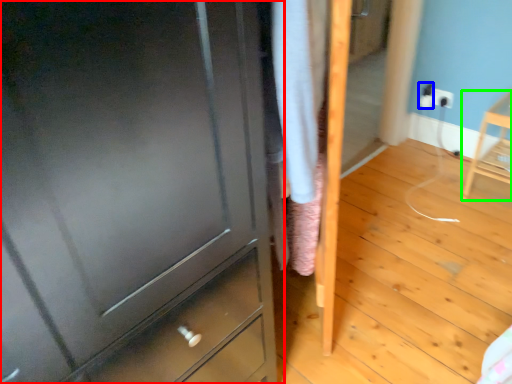
Question: Estimate the real-world distances between objects in this image. Which object is farther from chest of drawers (highlighted by a red box), electric outlet (highlighted by a blue box) or furniture (highlighted by a green box)?

Choices:
 (A) electric outlet
 (B) furniture

Answer: (A)